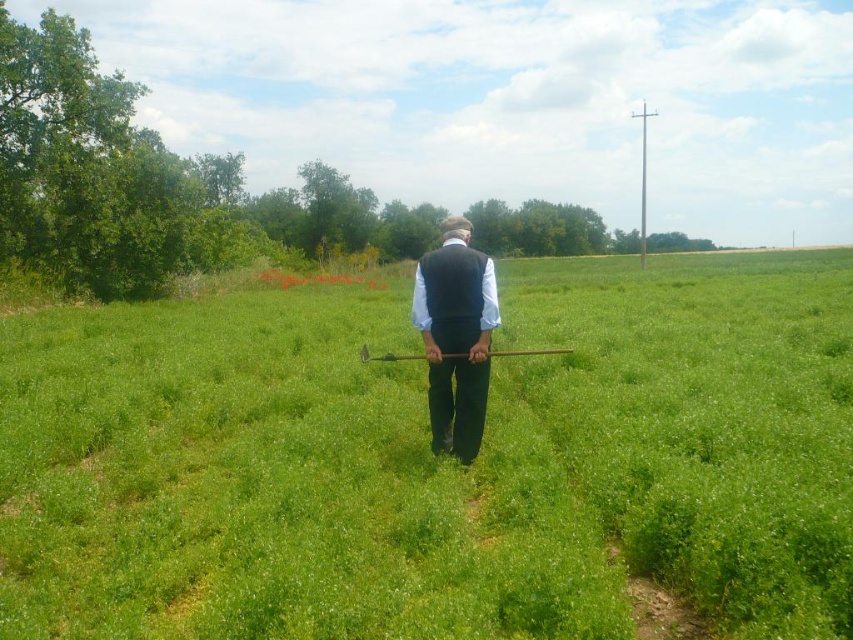
Does green grassy field at center appear on the right side of black matte vest at center?

Yes, green grassy field at center is to the right of black matte vest at center.

Does green grassy field at center have a smaller size compared to black matte vest at center?

No, green grassy field at center is not smaller than black matte vest at center.

Between point (578, 548) and point (485, 275), which one is positioned behind?

Positioned behind is point (485, 275).

This screenshot has width=853, height=640. Identify the location of green grassy field at center. (434, 460).